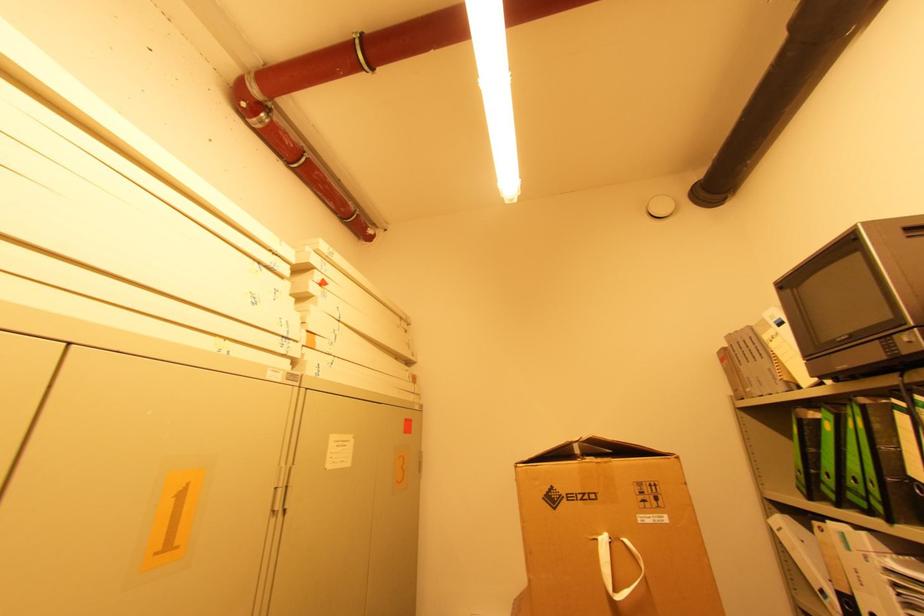
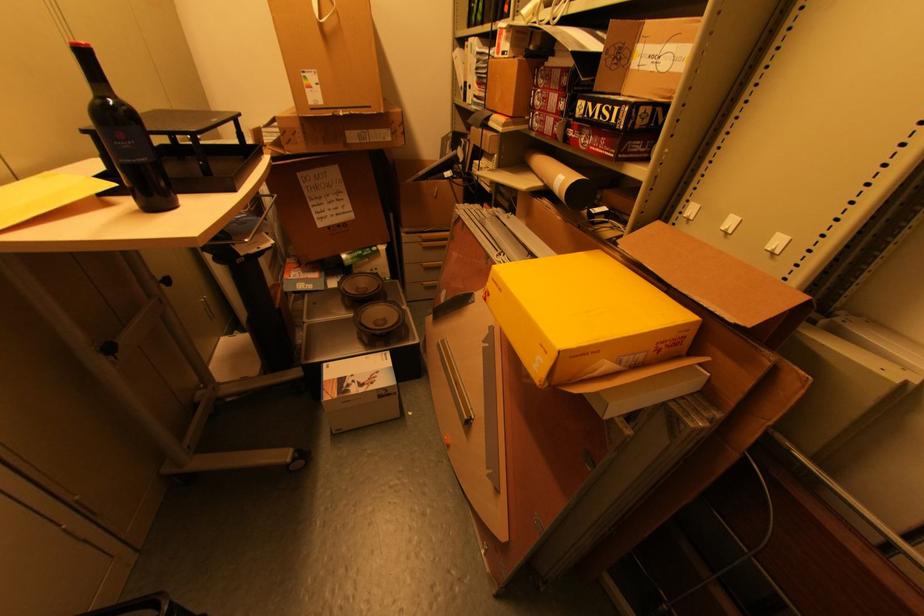
The first image is from the beginning of the video and the second image is from the end. How did the camera likely rotate when shooting the video?

The rotation direction of the camera is right-down.